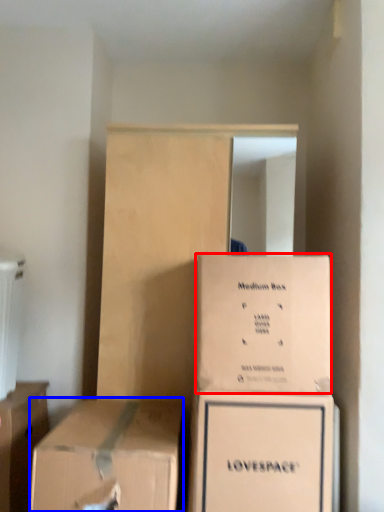
Question: Which point is closer to the camera, box (highlighted by a red box) or box (highlighted by a blue box)?

Choices:
 (A) box
 (B) box

Answer: (B)